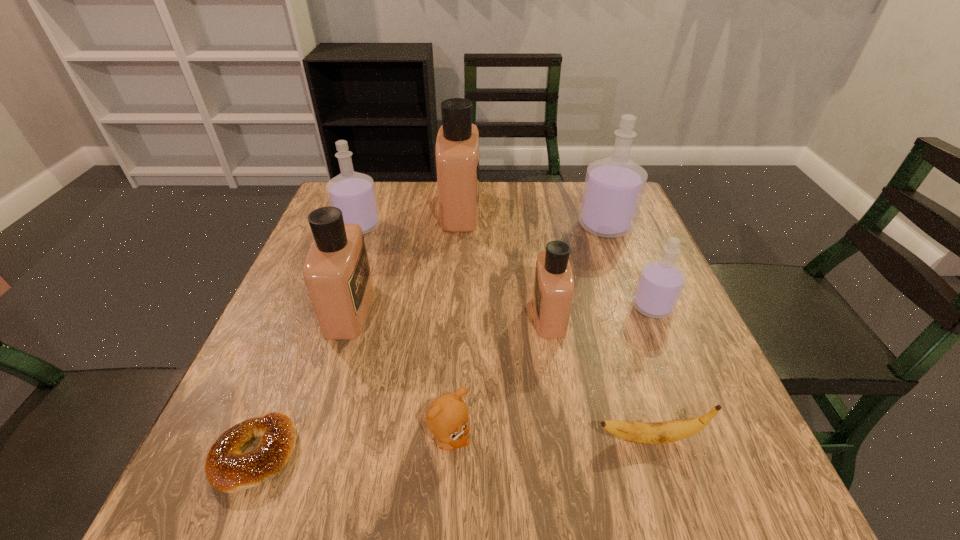
Find the location of a particular element. the fourth perfume from right to left is located at coordinates (457, 144).

The width and height of the screenshot is (960, 540). I want to click on the second beige perfume from left to right, so click(x=457, y=144).

Locate an element on the screen. This screenshot has width=960, height=540. the biggest purple perfume is located at coordinates (614, 186).

Find the location of a particular element. This screenshot has width=960, height=540. the second biggest purple perfume is located at coordinates (353, 193).

The width and height of the screenshot is (960, 540). Identify the location of the second smallest beige perfume. (336, 271).

Find the location of `the third perfume from right to left`. the third perfume from right to left is located at coordinates (553, 293).

Where is `the rightmost beige perfume`? the rightmost beige perfume is located at coordinates (553, 293).

Identify the location of the smallest purple perfume. (660, 283).

This screenshot has height=540, width=960. Find the location of `brown teddy bear`. brown teddy bear is located at coordinates (447, 418).

Find the location of a particular element. teddy bear is located at coordinates (447, 418).